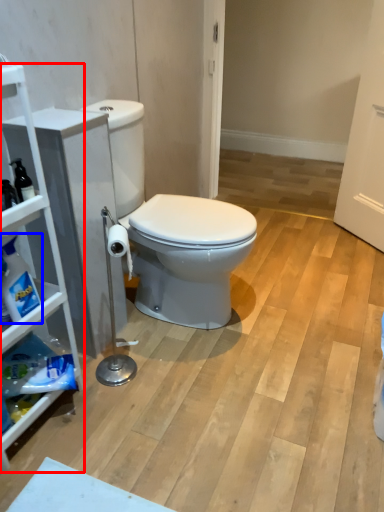
Question: Which object is closer to the camera taking this photo, cabinetry (highlighted by a red box) or cleaning product (highlighted by a blue box)?

Choices:
 (A) cabinetry
 (B) cleaning product

Answer: (A)